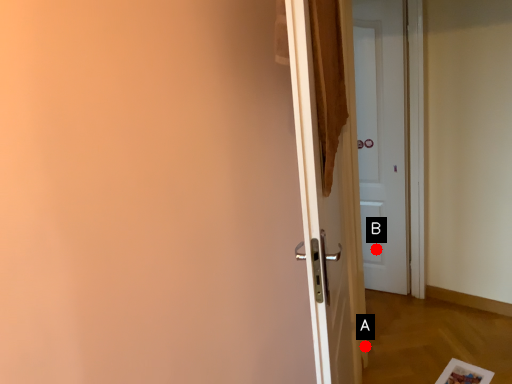
Question: Two points are circled on the image, labeled by A and B beside each circle. Which point is closer to the camera?

Choices:
 (A) A is closer
 (B) B is closer

Answer: (A)